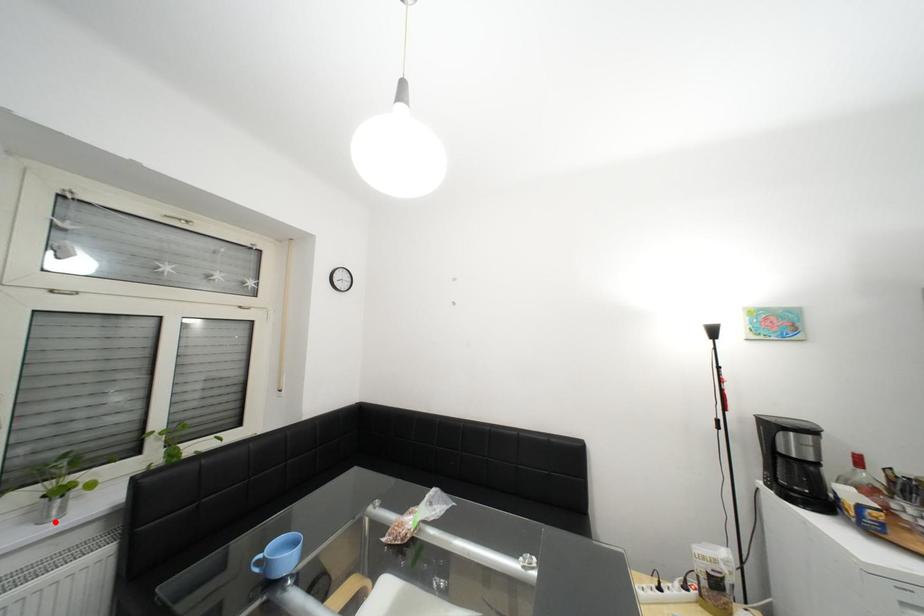
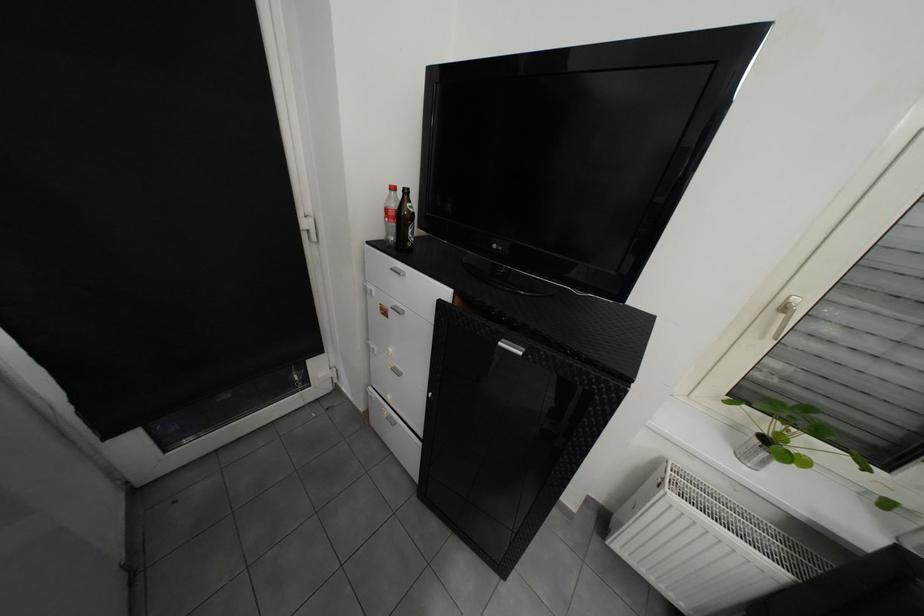
Question: I am providing you with two images of the same scene from different viewpoints. Given a red point in image1, look at the same physical point in image2. Is it:

Choices:
 (A) Closer to the viewpoint
 (B) Farther from the viewpoint

Answer: (B)